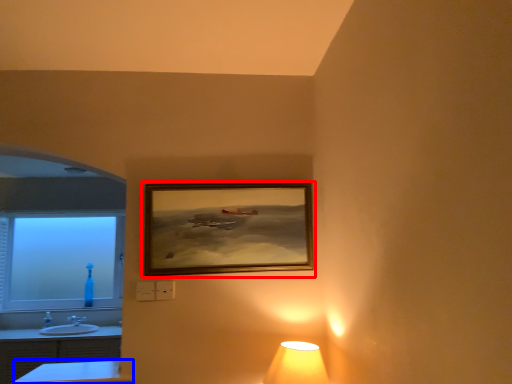
Question: Among these objects, which one is farthest to the camera, picture frame (highlighted by a red box) or table (highlighted by a blue box)?

Choices:
 (A) picture frame
 (B) table

Answer: (A)